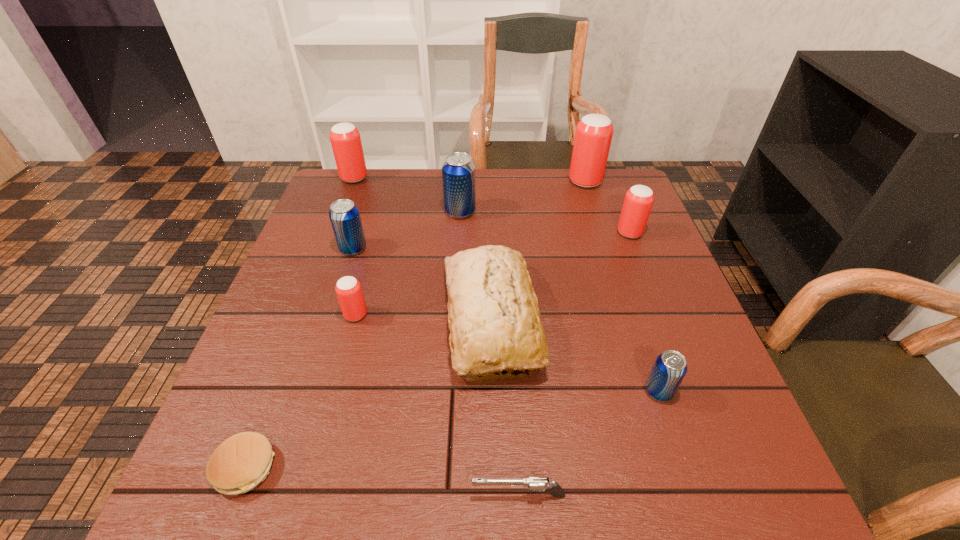
At what (x,y) coordinates should I click in order to perform the action: click on red beer can that stands as the closest to the fourth beer can from left to right. Please return your answer as a coordinate pair (x, y). The width and height of the screenshot is (960, 540). Looking at the image, I should click on (345, 139).

Identify which red beer can is located as the second nearest to the smallest red beer can. Please provide its 2D coordinates. Your answer should be formatted as a tuple, i.e. [(x, y)], where the tuple contains the x and y coordinates of a point satisfying the conditions above.

[(639, 199)]

Identify which blue beer can is located as the second nearest to the smallest red beer can. Please provide its 2D coordinates. Your answer should be formatted as a tuple, i.e. [(x, y)], where the tuple contains the x and y coordinates of a point satisfying the conditions above.

[(458, 170)]

Find the location of a particular element. This screenshot has width=960, height=540. the second closest blue beer can relative to the biggest blue beer can is located at coordinates (670, 367).

Locate an element on the screen. Image resolution: width=960 pixels, height=540 pixels. free location that satisfies the following two spatial constraints: 1. on the back side of the third red beer can from right to left; 2. on the left side of the tallest object is located at coordinates (392, 181).

Where is `free point that satisfies the following two spatial constraints: 1. on the back side of the second farthest blue beer can; 2. on the left side of the third biggest red beer can`? This screenshot has width=960, height=540. free point that satisfies the following two spatial constraints: 1. on the back side of the second farthest blue beer can; 2. on the left side of the third biggest red beer can is located at coordinates (358, 233).